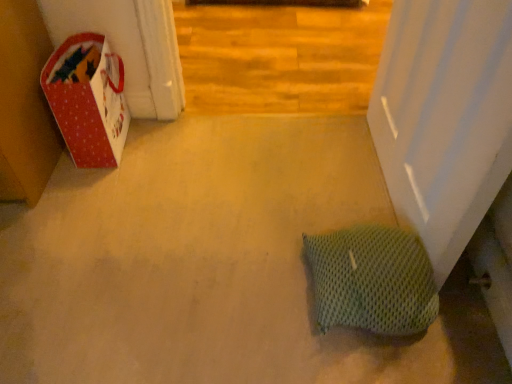
Question: Should I look upward or downward to see green mesh pillow at lower right?

Choices:
 (A) down
 (B) up

Answer: (A)

Question: Can you confirm if green mesh pillow at lower right is thinner than red paper bag at left?

Choices:
 (A) no
 (B) yes

Answer: (B)

Question: Is green mesh pillow at lower right to the left of red paper bag at left from the viewer's perspective?

Choices:
 (A) no
 (B) yes

Answer: (A)

Question: From the image's perspective, is green mesh pillow at lower right beneath red paper bag at left?

Choices:
 (A) no
 (B) yes

Answer: (B)

Question: Is green mesh pillow at lower right to the right of red paper bag at left from the viewer's perspective?

Choices:
 (A) no
 (B) yes

Answer: (B)

Question: Considering the relative sizes of green mesh pillow at lower right and red paper bag at left in the image provided, is green mesh pillow at lower right smaller than red paper bag at left?

Choices:
 (A) no
 (B) yes

Answer: (B)

Question: Is red paper bag at left at the back of green mesh pillow at lower right?

Choices:
 (A) no
 (B) yes

Answer: (A)

Question: Can you confirm if red paper bag at left is positioned to the right of green mesh pillow at lower right?

Choices:
 (A) yes
 (B) no

Answer: (B)

Question: Is red paper bag at left aimed at green mesh pillow at lower right?

Choices:
 (A) no
 (B) yes

Answer: (A)

Question: Considering the relative sizes of red paper bag at left and green mesh pillow at lower right in the image provided, is red paper bag at left wider than green mesh pillow at lower right?

Choices:
 (A) no
 (B) yes

Answer: (B)

Question: Is red paper bag at left positioned beyond the bounds of green mesh pillow at lower right?

Choices:
 (A) yes
 (B) no

Answer: (A)

Question: Is red paper bag at left further to the viewer compared to green mesh pillow at lower right?

Choices:
 (A) yes
 (B) no

Answer: (A)

Question: Can you confirm if red paper bag at left is bigger than green mesh pillow at lower right?

Choices:
 (A) no
 (B) yes

Answer: (B)

Question: Would you say red paper bag at left is to the left or to the right of green mesh pillow at lower right in the picture?

Choices:
 (A) left
 (B) right

Answer: (A)